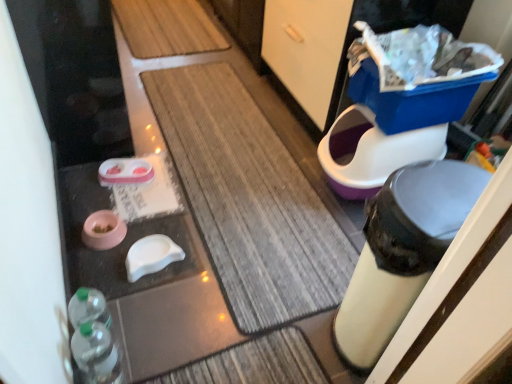
What do you see at coordinates (401, 103) in the screenshot? The height and width of the screenshot is (384, 512). I see `blue plastic potty at right, the 2th potty from the left` at bounding box center [401, 103].

In order to click on pink matte pet food bowl at lower left, which appears as the first potty when viewed from the left in this screenshot , I will do `click(103, 230)`.

At what (x,y) coordinates should I click in order to perform the action: click on textured brown bath mat at center. Please return your answer as a coordinate pair (x, y). The height and width of the screenshot is (384, 512). Looking at the image, I should click on (249, 199).

Based on the photo, visually, is pink matte pet food bowl at lower left, which appears as the first potty when viewed from the left, positioned to the left or to the right of matte white toilet bowl at right?

From the image, it's evident that pink matte pet food bowl at lower left, which appears as the first potty when viewed from the left, is to the left of matte white toilet bowl at right.

Where is `toilet bowl in front of the pink matte pet food bowl at lower left, the first potty from the bottom`? Image resolution: width=512 pixels, height=384 pixels. toilet bowl in front of the pink matte pet food bowl at lower left, the first potty from the bottom is located at coordinates [372, 152].

From a real-world perspective, which is physically above, pink matte pet food bowl at lower left, arranged as the second potty when viewed from the top, or matte white toilet bowl at right?

matte white toilet bowl at right.

Does pink matte pet food bowl at lower left, which appears as the first potty when viewed from the left, come behind matte white toilet bowl at right?

Yes, the depth of pink matte pet food bowl at lower left, which appears as the first potty when viewed from the left, is greater than that of matte white toilet bowl at right.

Does matte white toilet bowl at right contain blue plastic potty at right, the 2th potty from the left?

No, matte white toilet bowl at right does not contain blue plastic potty at right, the 2th potty from the left.

Can you confirm if matte white toilet bowl at right is thinner than blue plastic potty at right, the 2th potty when ordered from bottom to top?

Indeed, matte white toilet bowl at right has a lesser width compared to blue plastic potty at right, the 2th potty when ordered from bottom to top.

From the image's perspective, is matte white toilet bowl at right beneath blue plastic potty at right, the first potty viewed from the top?

Yes, from the image's perspective, matte white toilet bowl at right is below blue plastic potty at right, the first potty viewed from the top.

Locate an element on the screen. This screenshot has height=384, width=512. toilet bowl behind the blue plastic potty at right, the first potty viewed from the top is located at coordinates (372, 152).

Is pink matte pet food bowl at lower left, marked as the second potty in a right-to-left arrangement, turned away from blue plastic potty at right, the 2th potty from the left?

No, pink matte pet food bowl at lower left, marked as the second potty in a right-to-left arrangement,'s orientation is not away from blue plastic potty at right, the 2th potty from the left.

Find the location of `potty below the blue plastic potty at right, which appears as the 1th potty when viewed from the right (from the image's perspective)`. potty below the blue plastic potty at right, which appears as the 1th potty when viewed from the right (from the image's perspective) is located at coordinates (103, 230).

Is pink matte pet food bowl at lower left, which appears as the first potty when viewed from the left, next to blue plastic potty at right, which appears as the 1th potty when viewed from the right?

There is a gap between pink matte pet food bowl at lower left, which appears as the first potty when viewed from the left, and blue plastic potty at right, which appears as the 1th potty when viewed from the right.

How far apart are pink matte pet food bowl at lower left, marked as the second potty in a right-to-left arrangement, and blue plastic potty at right, the 2th potty when ordered from bottom to top?

pink matte pet food bowl at lower left, marked as the second potty in a right-to-left arrangement, is 3.96 feet from blue plastic potty at right, the 2th potty when ordered from bottom to top.

Does pink matte pet food bowl at lower left, marked as the second potty in a right-to-left arrangement, come behind translucent plastic bottles at lower left?

Yes.

From a real-world perspective, which object rests below the other?

In real-world perspective, pink matte pet food bowl at lower left, the first potty from the bottom, is lower.

Considering the positions of objects pink matte pet food bowl at lower left, arranged as the second potty when viewed from the top, and translucent plastic bottles at lower left in the image provided, who is more to the left, pink matte pet food bowl at lower left, arranged as the second potty when viewed from the top, or translucent plastic bottles at lower left?

pink matte pet food bowl at lower left, arranged as the second potty when viewed from the top.

Can you confirm if pink matte pet food bowl at lower left, which appears as the first potty when viewed from the left, is bigger than matte black trash can at right?

Incorrect, pink matte pet food bowl at lower left, which appears as the first potty when viewed from the left, is not larger than matte black trash can at right.

Which of these two, pink matte pet food bowl at lower left, which appears as the first potty when viewed from the left, or matte black trash can at right, is thinner?

Thinner between the two is pink matte pet food bowl at lower left, which appears as the first potty when viewed from the left.

Could you tell me if pink matte pet food bowl at lower left, which appears as the first potty when viewed from the left, is facing matte black trash can at right?

No, pink matte pet food bowl at lower left, which appears as the first potty when viewed from the left, is not aimed at matte black trash can at right.

Between point (89, 231) and point (361, 285), which one is positioned in front?

Positioned in front is point (361, 285).

Based on their positions, is textured brown bath mat at center located to the left or right of blue plastic potty at right, the first potty viewed from the top?

Clearly, textured brown bath mat at center is on the left of blue plastic potty at right, the first potty viewed from the top, in the image.

Does textured brown bath mat at center touch blue plastic potty at right, the 2th potty when ordered from bottom to top?

textured brown bath mat at center and blue plastic potty at right, the 2th potty when ordered from bottom to top, are clearly separated.

Is textured brown bath mat at center thinner than blue plastic potty at right, the 2th potty when ordered from bottom to top?

No, textured brown bath mat at center is not thinner than blue plastic potty at right, the 2th potty when ordered from bottom to top.

From the image's perspective, is textured brown bath mat at center located above or below blue plastic potty at right, the 2th potty when ordered from bottom to top?

Clearly, from the image's perspective, textured brown bath mat at center is below blue plastic potty at right, the 2th potty when ordered from bottom to top.

I want to click on potty that appears on the left of matte black trash can at right, so click(x=103, y=230).

Can you confirm if matte black trash can at right is thinner than pink matte pet food bowl at lower left, the first potty from the bottom?

In fact, matte black trash can at right might be wider than pink matte pet food bowl at lower left, the first potty from the bottom.

From the picture: Which object is more forward, matte black trash can at right or pink matte pet food bowl at lower left, the first potty from the bottom?

matte black trash can at right is more forward.

The height and width of the screenshot is (384, 512). Find the location of `toilet bowl above the pink matte pet food bowl at lower left, arranged as the second potty when viewed from the top (from the image's perspective)`. toilet bowl above the pink matte pet food bowl at lower left, arranged as the second potty when viewed from the top (from the image's perspective) is located at coordinates (372, 152).

Locate an element on the screen. The height and width of the screenshot is (384, 512). toilet bowl behind the blue plastic potty at right, the 2th potty from the left is located at coordinates (372, 152).

From the image, which object appears to be nearer to textured brown bath mat at center, matte black trash can at right or matte white toilet bowl at right?

matte white toilet bowl at right.

Which object lies further to the anchor point matte black trash can at right, translucent plastic bottles at lower left or textured brown bath mat at center?

translucent plastic bottles at lower left is positioned further to the anchor matte black trash can at right.

From the image, which object appears to be nearer to pink matte pet food bowl at lower left, the first potty from the bottom, textured brown bath mat at center or blue plastic potty at right, the first potty viewed from the top?

Result: textured brown bath mat at center.

Based on their spatial positions, is matte black trash can at right or blue plastic potty at right, the 2th potty when ordered from bottom to top, closer to textured brown bath mat at center?

Based on the image, blue plastic potty at right, the 2th potty when ordered from bottom to top, appears to be nearer to textured brown bath mat at center.

Which object lies nearer to the anchor point blue plastic potty at right, the first potty viewed from the top, textured brown bath mat at center or matte black trash can at right?

textured brown bath mat at center lies closer to blue plastic potty at right, the first potty viewed from the top, than the other object.

In the scene shown: From the image, which object appears to be nearer to pink matte pet food bowl at lower left, which appears as the first potty when viewed from the left, matte black trash can at right or matte white toilet bowl at right?

The object closer to pink matte pet food bowl at lower left, which appears as the first potty when viewed from the left, is matte black trash can at right.

Estimate the real-world distances between objects in this image. Which object is further from pink matte pet food bowl at lower left, which appears as the first potty when viewed from the left, textured brown bath mat at center or matte black trash can at right?

matte black trash can at right.

Estimate the real-world distances between objects in this image. Which object is closer to blue plastic potty at right, which appears as the 1th potty when viewed from the right, matte white toilet bowl at right or matte black trash can at right?

matte white toilet bowl at right.

Where is `trash bin/can between textured brown bath mat at center and blue plastic potty at right, the 2th potty from the left`? Image resolution: width=512 pixels, height=384 pixels. trash bin/can between textured brown bath mat at center and blue plastic potty at right, the 2th potty from the left is located at coordinates (402, 251).

Identify the location of bath mat located between translucent plastic bottles at lower left and matte black trash can at right in the left-right direction. (249, 199).

The width and height of the screenshot is (512, 384). I want to click on bottle located between pink matte pet food bowl at lower left, arranged as the second potty when viewed from the top, and matte black trash can at right in the left-right direction, so click(97, 353).

Find the location of a particular element. The width and height of the screenshot is (512, 384). bath mat between pink matte pet food bowl at lower left, which appears as the first potty when viewed from the left, and blue plastic potty at right, which appears as the 1th potty when viewed from the right, from left to right is located at coordinates (249, 199).